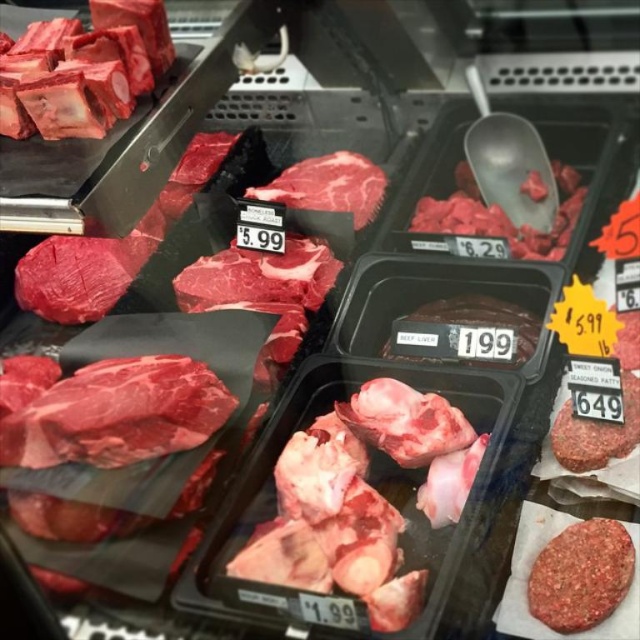
You are standing in front of the meat department display case and want to locate two specific points marked on the glass. The first point is at coordinate point (484, 214) and the second is at point (323, 161). Which point appears closer to you when looking through the glass?

Answer: Point (484, 214) is closer to the camera than point (323, 161), so it appears closer to you when looking through the glass.

You are a customer in the grocery store and want to buy both the dark brown textured beef at center and the dark red raw meat at center. The store has a height restriction of 10 cm for meat trays. Can both items fit in your shopping bag, which has a height limit of 10 cm?

The dark brown textured beef at center is not as tall as dark red raw meat at center. Since the height limit is 10 cm, we need to check the tallest item. If the dark red raw meat at center is taller than 10 cm, then it won